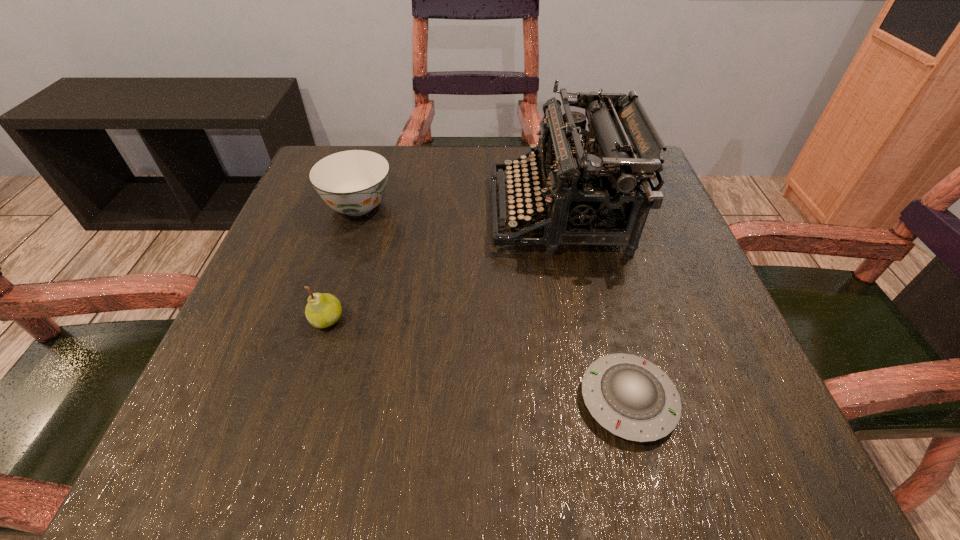
This screenshot has width=960, height=540. Identify the location of object located in the near right corner section of the desktop. (629, 396).

Identify the location of free space at the far edge. (485, 152).

At what (x,y) coordinates should I click in order to perform the action: click on free space at the near edge of the desktop. Please return your answer as a coordinate pair (x, y). This screenshot has height=540, width=960. Looking at the image, I should click on (314, 432).

Find the location of `vacant area at the left edge of the desktop`. vacant area at the left edge of the desktop is located at coordinates (362, 220).

Locate an element on the screen. The height and width of the screenshot is (540, 960). vacant position at the right edge of the desktop is located at coordinates (687, 263).

The width and height of the screenshot is (960, 540). I want to click on free space between the soup bowl and the tallest object, so click(x=458, y=209).

Where is `empty space that is in between the nearest object and the tallest object`? empty space that is in between the nearest object and the tallest object is located at coordinates click(x=593, y=306).

Locate an element on the screen. vacant point located between the soup bowl and the third farthest object is located at coordinates (343, 262).

Find the location of `free space between the saucer and the third farthest object`. free space between the saucer and the third farthest object is located at coordinates (478, 360).

You are a GUI agent. You are given a task and a screenshot of the screen. Output one action in this format:
    pyautogui.click(x=<x>, y=<y>)
    Task: Click on the vacant point located between the shortest object and the soup bowl
    This screenshot has width=960, height=540.
    Given the screenshot: What is the action you would take?
    pyautogui.click(x=493, y=303)